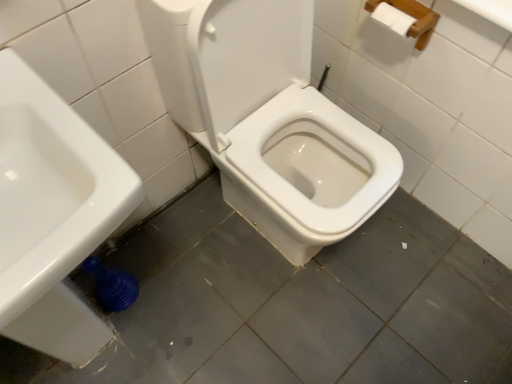
This screenshot has height=384, width=512. Find the location of `free space underneath white glossy sink at lower left (from a real-world perspective)`. free space underneath white glossy sink at lower left (from a real-world perspective) is located at coordinates (109, 331).